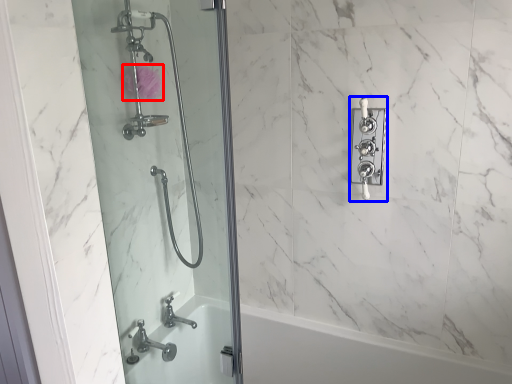
Question: Among these objects, which one is nearest to the camera, flower (highlighted by a red box) or lock (highlighted by a blue box)?

Choices:
 (A) flower
 (B) lock

Answer: (B)